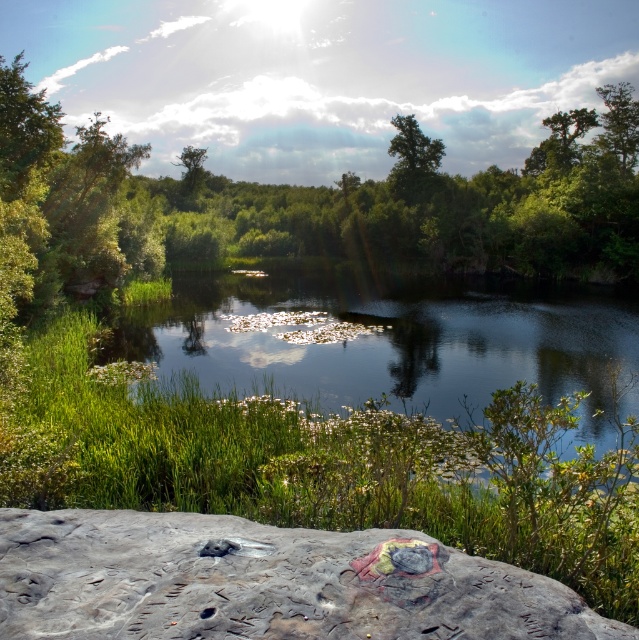
Who is higher up, rough stone boulder at lower center or green grassy river at center?

green grassy river at center

The image size is (639, 640). What do you see at coordinates (263, 582) in the screenshot? I see `rough stone boulder at lower center` at bounding box center [263, 582].

Where is `rough stone boulder at lower center`? Image resolution: width=639 pixels, height=640 pixels. rough stone boulder at lower center is located at coordinates (263, 582).

Is rough stone boulder at lower center taller than green leafy tree at upper center?

In fact, rough stone boulder at lower center may be shorter than green leafy tree at upper center.

Between rough stone boulder at lower center and green leafy tree at upper center, which one is positioned higher?

green leafy tree at upper center is above.

This screenshot has height=640, width=639. What do you see at coordinates (263, 582) in the screenshot?
I see `rough stone boulder at lower center` at bounding box center [263, 582].

The image size is (639, 640). Find the location of `rough stone boulder at lower center`. rough stone boulder at lower center is located at coordinates [263, 582].

Between green grassy river at center and green leafy tree at upper center, which one is positioned higher?

green leafy tree at upper center is higher up.

Between point (406, 291) and point (181, 150), which one is positioned in front?

Point (406, 291) is in front.

Describe the element at coordinates (394, 340) in the screenshot. The width and height of the screenshot is (639, 640). I see `green grassy river at center` at that location.

Locate an element on the screen. green grassy river at center is located at coordinates (394, 340).